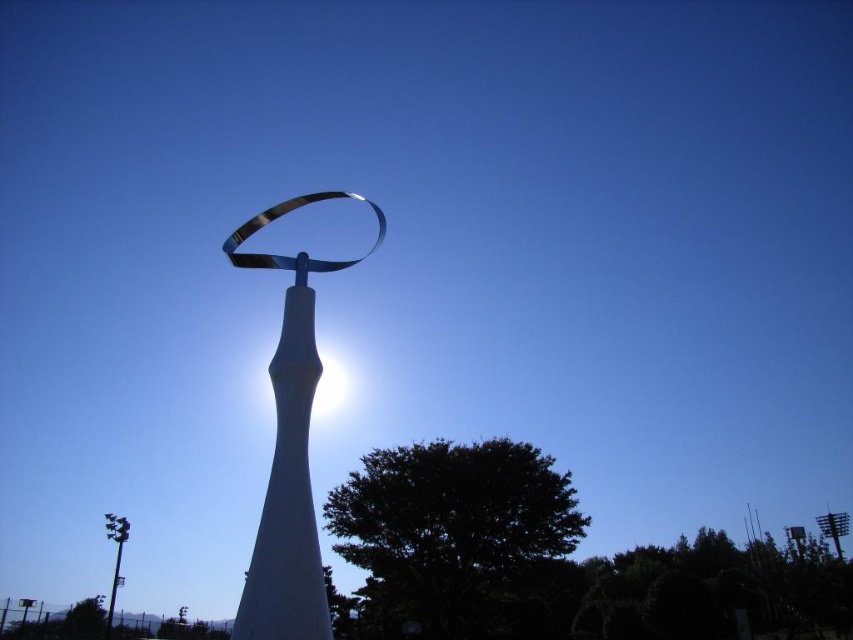
Question: Is sleek silver ribbon at center thinner than metallic gray pole at lower left?

Choices:
 (A) no
 (B) yes

Answer: (B)

Question: Which point is closer to the camera taking this photo?

Choices:
 (A) (120, 540)
 (B) (225, 248)

Answer: (B)

Question: Is sleek silver ribbon at center thinner than metallic gray pole at lower left?

Choices:
 (A) no
 (B) yes

Answer: (B)

Question: Is sleek silver ribbon at center closer to camera compared to metallic gray pole at lower left?

Choices:
 (A) yes
 (B) no

Answer: (A)